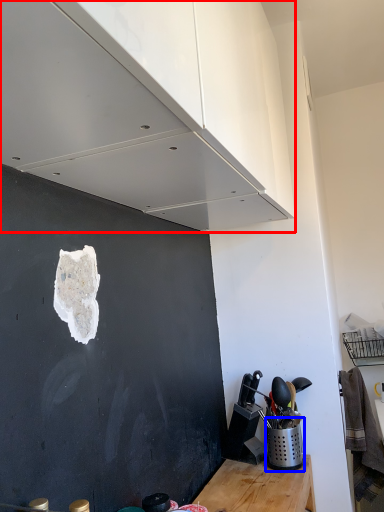
Question: Among these objects, which one is nearest to the camera, cabinetry (highlighted by a red box) or appliance (highlighted by a blue box)?

Choices:
 (A) cabinetry
 (B) appliance

Answer: (A)